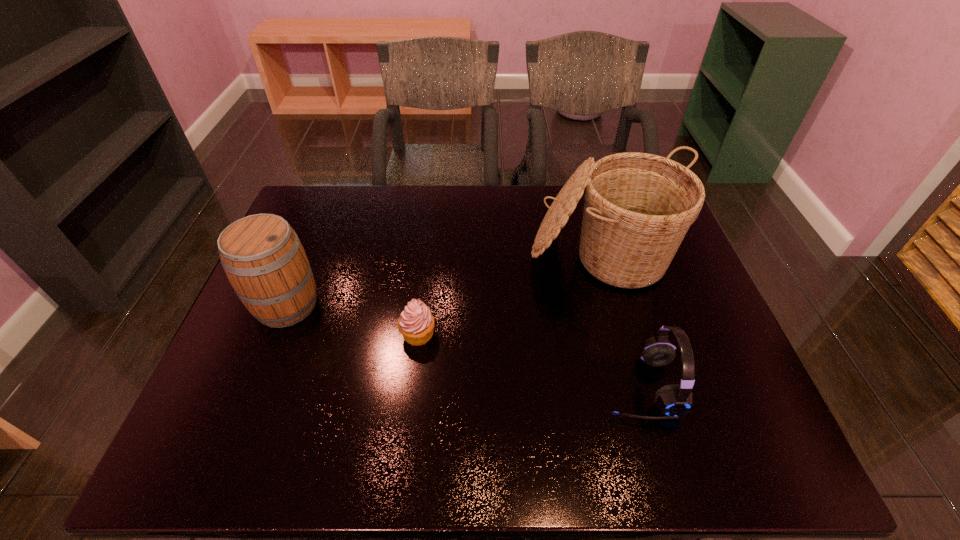
Where is `free region at the right edge`? The height and width of the screenshot is (540, 960). free region at the right edge is located at coordinates (749, 409).

Image resolution: width=960 pixels, height=540 pixels. In order to click on vacant space at the far left corner of the desktop in this screenshot , I will do 344,207.

I want to click on free space at the near right corner of the desktop, so click(754, 445).

Where is `empty space that is in between the headset and the cupcake`? The height and width of the screenshot is (540, 960). empty space that is in between the headset and the cupcake is located at coordinates (528, 360).

This screenshot has width=960, height=540. In order to click on unoccupied position between the leftmost object and the basket in this screenshot , I will do pos(444,280).

The width and height of the screenshot is (960, 540). What are the coordinates of `empty space between the basket and the headset` in the screenshot? It's located at (621, 320).

Locate an element on the screen. The width and height of the screenshot is (960, 540). free point between the cupcake and the basket is located at coordinates (511, 294).

Identify the location of free space between the leftmost object and the shortest object. (x=352, y=320).

Identify the location of vacant space in between the cider and the cupcake. (352, 320).

Locate an element on the screen. free space between the shortest object and the basket is located at coordinates (511, 294).